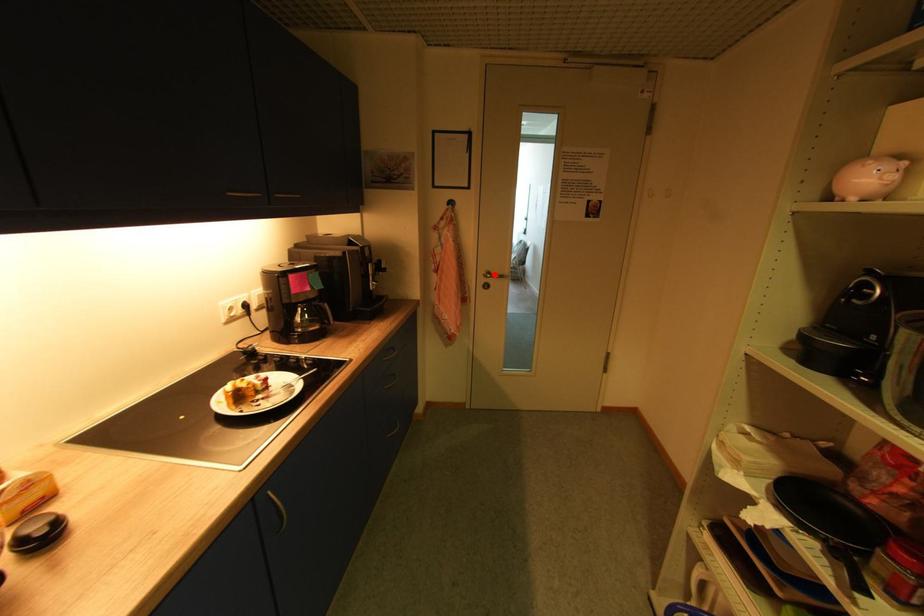
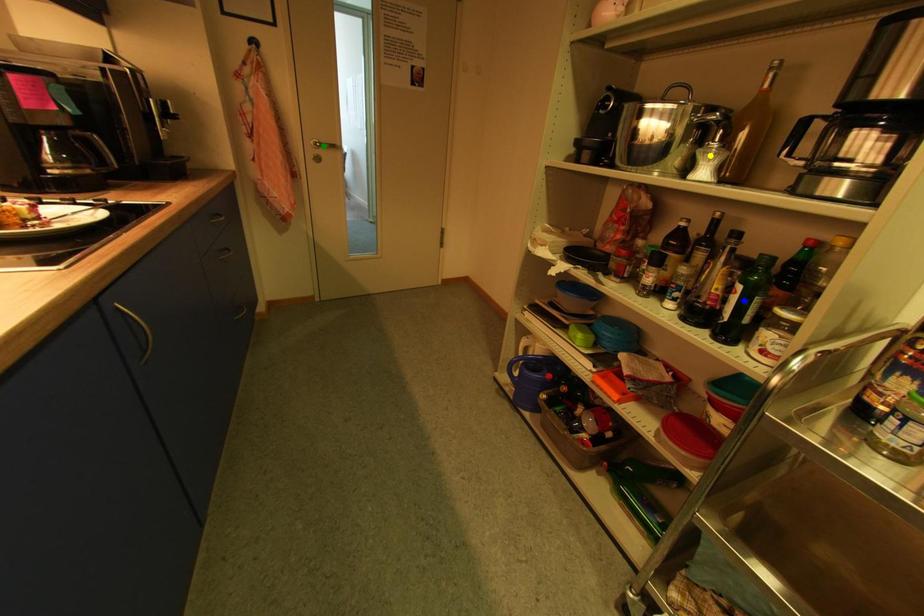
Question: I am providing you with two images of the same scene from different viewpoints. A red point is marked on the first image. You are given multiple points on the second image. In image 2, which mark is for the same physical point as the one in image 1?

Choices:
 (A) yellow point
 (B) green point
 (C) blue point

Answer: (B)